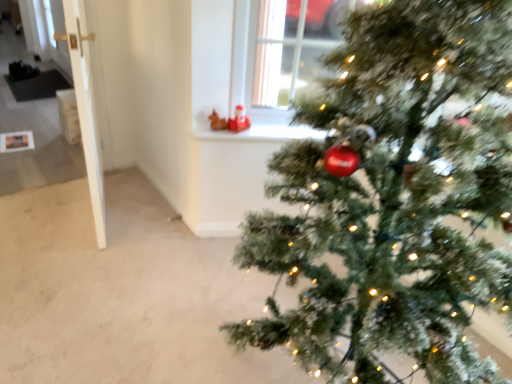
Question: Considering the relative positions of green frosted christmas tree at right and white glossy window sill at upper center in the image provided, is green frosted christmas tree at right to the left or to the right of white glossy window sill at upper center?

Choices:
 (A) right
 (B) left

Answer: (A)

Question: Is green frosted christmas tree at right in front of or behind white glossy window sill at upper center in the image?

Choices:
 (A) behind
 (B) front

Answer: (B)

Question: Does point (397, 152) appear closer or farther from the camera than point (309, 132)?

Choices:
 (A) farther
 (B) closer

Answer: (B)

Question: From a real-world perspective, is white glossy window sill at upper center physically located above or below green frosted christmas tree at right?

Choices:
 (A) below
 (B) above

Answer: (A)

Question: Considering the positions of point (268, 130) and point (490, 11), is point (268, 130) closer or farther from the camera than point (490, 11)?

Choices:
 (A) closer
 (B) farther

Answer: (B)

Question: From the image's perspective, is white glossy window sill at upper center located above or below green frosted christmas tree at right?

Choices:
 (A) above
 (B) below

Answer: (A)

Question: Based on their sizes in the image, would you say white glossy window sill at upper center is bigger or smaller than green frosted christmas tree at right?

Choices:
 (A) big
 (B) small

Answer: (B)